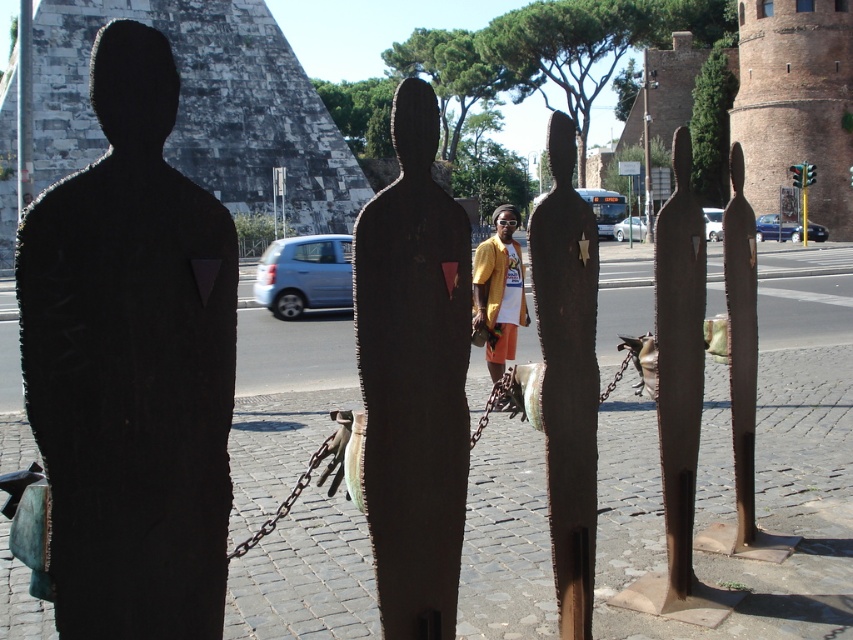
You are a photographer standing in the middle of the street scene. You want to take a photo of both the yellow matte shirt at center and the brushed metal pole at center. Which object should you position to your left to include both in the frame?

The yellow matte shirt at center is to the left of the brushed metal pole at center, so you should position the yellow matte shirt at center to your left side and the brushed metal pole at center to your right side to include both in the frame.

You are an artist planning to photograph the black matte statue at left and the yellow matte shirt at center in the scene. If you want to ensure both objects are fully visible in your frame without cropping, which object should you position closer to the camera?

The black matte statue at left is narrower than the yellow matte shirt at center. To ensure both are fully visible, position the yellow matte shirt at center closer to the camera since it is wider and requires more space in the frame.

You are standing on the cobblestone pavement in the street scene. You see a rustic wood figure at center and a point marked at coordinates (415,378). Where is this point located?

The point at (415,378) is on the rustic wood figure at center.